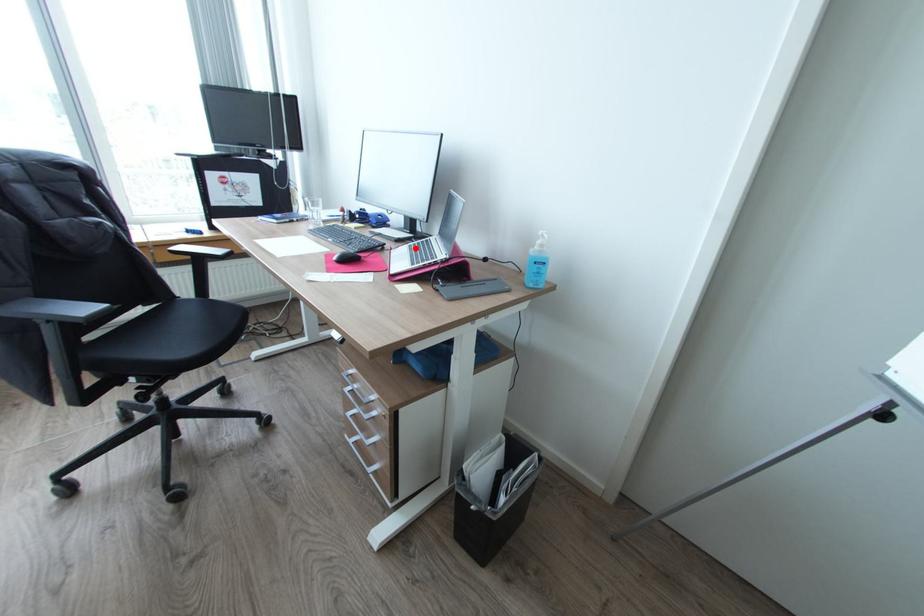
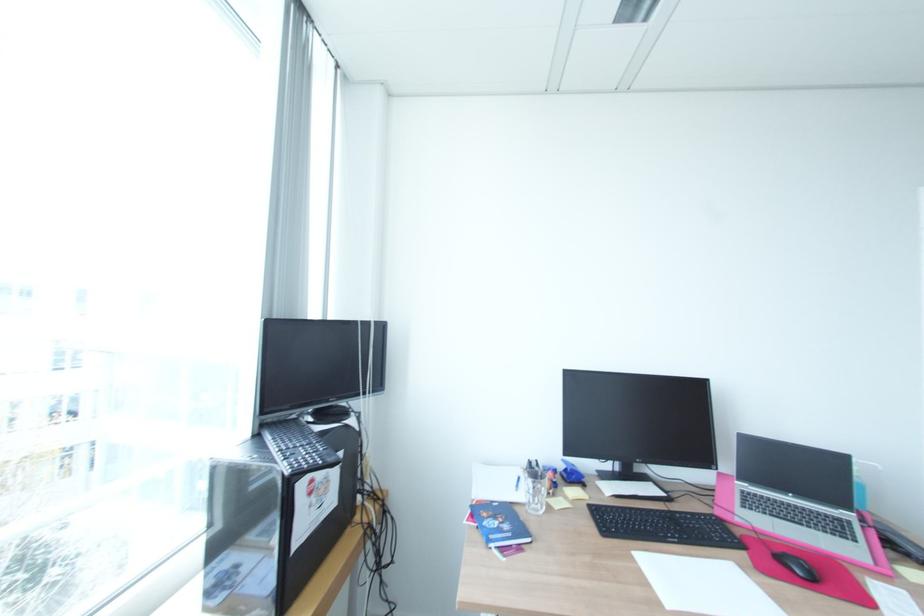
Locate, in the second image, the point that corresponds to the highlighted location in the first image.

(770, 513)